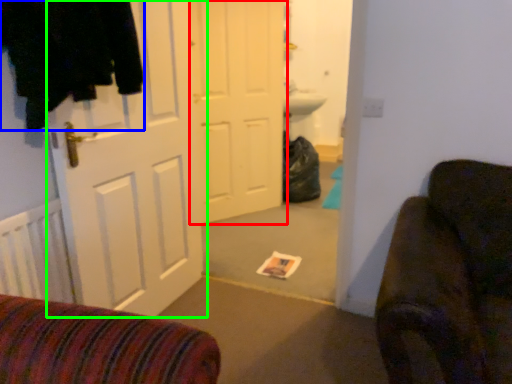
Question: Considering the real-world distances, which object is closest to door (highlighted by a red box)? clothing (highlighted by a blue box) or door (highlighted by a green box).

Choices:
 (A) clothing
 (B) door

Answer: (B)